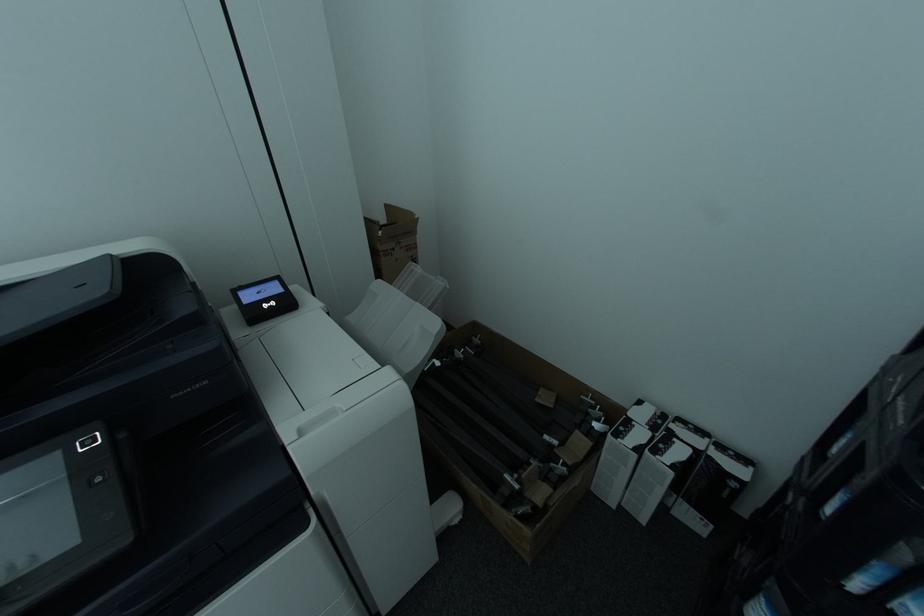
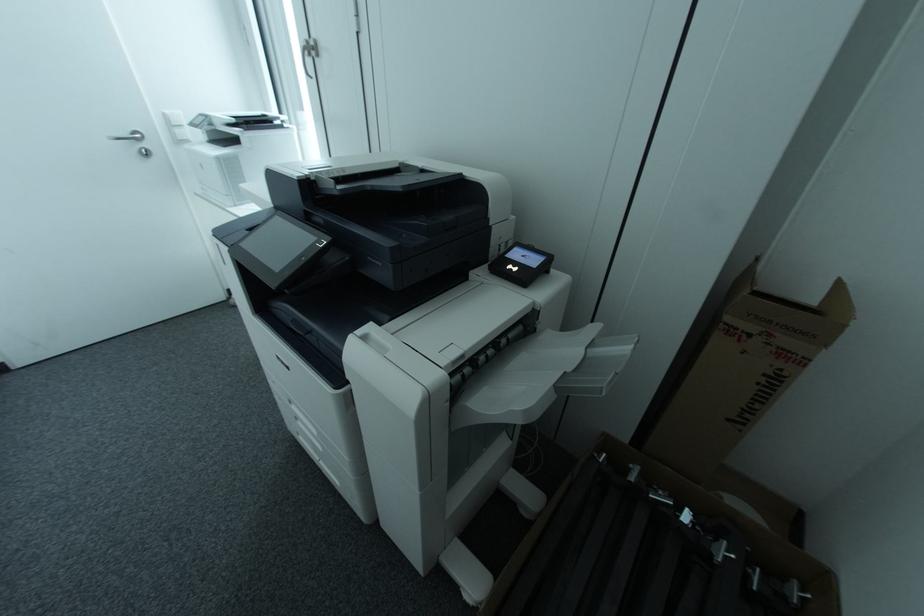
How did the camera likely rotate?

The camera's rotation is toward left-down.